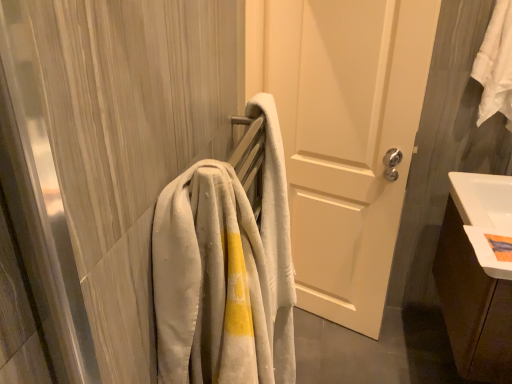
The image size is (512, 384). What do you see at coordinates (343, 136) in the screenshot?
I see `white matte door at center` at bounding box center [343, 136].

What do you see at coordinates (472, 305) in the screenshot? This screenshot has width=512, height=384. I see `brown wood cabinet at lower right` at bounding box center [472, 305].

Measure the distance between brown wood cabinet at lower right and camera.

The distance of brown wood cabinet at lower right from camera is 1.10 meters.

The height and width of the screenshot is (384, 512). Describe the element at coordinates (217, 285) in the screenshot. I see `light gray plush towel at left` at that location.

Where is `white cotton towel at upper right`? The height and width of the screenshot is (384, 512). white cotton towel at upper right is located at coordinates (496, 65).

Identify the location of white matte door at center. This screenshot has width=512, height=384. (343, 136).

From the image's perspective, which is below, white glossy sink at lower right or light gray plush towel at left?

light gray plush towel at left is shown below in the image.

Who is more distant, white glossy sink at lower right or light gray plush towel at left?

white glossy sink at lower right.

From a real-world perspective, which object rests below the other?

white glossy sink at lower right.

How many degrees apart are the facing directions of white glossy sink at lower right and light gray plush towel at left?

176 degrees separate the facing orientations of white glossy sink at lower right and light gray plush towel at left.

From the picture: Could you tell me if light gray plush towel at left is turned towards white glossy sink at lower right?

No, light gray plush towel at left does not turn towards white glossy sink at lower right.

Considering the relative positions of light gray plush towel at left and white glossy sink at lower right in the image provided, is light gray plush towel at left to the right of white glossy sink at lower right from the viewer's perspective?

No, light gray plush towel at left is not to the right of white glossy sink at lower right.

Does light gray plush towel at left have a lesser width compared to white glossy sink at lower right?

Yes.

I want to click on door located on the left of white glossy sink at lower right, so click(x=343, y=136).

Who is smaller, white glossy sink at lower right or white matte door at center?

With smaller size is white glossy sink at lower right.

Considering the points (487, 215) and (322, 35), which point is behind, point (487, 215) or point (322, 35)?

The point (322, 35) is farther from the camera.

What's the angular difference between white glossy sink at lower right and white matte door at center's facing directions?

There is a 80.3-degree angle between the facing directions of white glossy sink at lower right and white matte door at center.

Based on the photo, from the image's perspective, is brown wood cabinet at lower right located beneath white cotton towel at upper right?

Correct, brown wood cabinet at lower right appears lower than white cotton towel at upper right in the image.

Is brown wood cabinet at lower right shorter than white cotton towel at upper right?

Indeed, brown wood cabinet at lower right has a lesser height compared to white cotton towel at upper right.

Could you tell me if brown wood cabinet at lower right is turned towards white cotton towel at upper right?

No, brown wood cabinet at lower right is not turned towards white cotton towel at upper right.

In the scene shown: Is brown wood cabinet at lower right not within white cotton towel at upper right?

Indeed, brown wood cabinet at lower right is completely outside white cotton towel at upper right.

Could you tell me if brown wood cabinet at lower right is turned towards light gray plush towel at left?

No, brown wood cabinet at lower right is not oriented towards light gray plush towel at left.

Between brown wood cabinet at lower right and light gray plush towel at left, which one has more height?

light gray plush towel at left is taller.

Considering the relative sizes of brown wood cabinet at lower right and light gray plush towel at left in the image provided, is brown wood cabinet at lower right bigger than light gray plush towel at left?

Indeed, brown wood cabinet at lower right has a larger size compared to light gray plush towel at left.

Does brown wood cabinet at lower right have a lesser width compared to light gray plush towel at left?

Incorrect, the width of brown wood cabinet at lower right is not less than that of light gray plush towel at left.

Is brown wood cabinet at lower right to the left of white glossy sink at lower right from the viewer's perspective?

In fact, brown wood cabinet at lower right is to the right of white glossy sink at lower right.

From a real-world perspective, is brown wood cabinet at lower right positioned over white glossy sink at lower right based on gravity?

Incorrect, from a real-world perspective, brown wood cabinet at lower right is lower than white glossy sink at lower right.

How distant is brown wood cabinet at lower right from white glossy sink at lower right?

They are 6.75 inches apart.

Is brown wood cabinet at lower right a part of white glossy sink at lower right?

No, brown wood cabinet at lower right is not surrounded by white glossy sink at lower right.

Does white glossy sink at lower right touch brown wood cabinet at lower right?

No, white glossy sink at lower right is not with brown wood cabinet at lower right.

Based on the photo, is white glossy sink at lower right taller or shorter than brown wood cabinet at lower right?

Clearly, white glossy sink at lower right is shorter compared to brown wood cabinet at lower right.

Where is `sink located behind the light gray plush towel at left`? sink located behind the light gray plush towel at left is located at coordinates (484, 215).

Locate an element on the screen. This screenshot has height=384, width=512. sink below the light gray plush towel at left (from a real-world perspective) is located at coordinates (484, 215).

Based on their spatial positions, is brown wood cabinet at lower right or white matte door at center closer to white glossy sink at lower right?

brown wood cabinet at lower right is closer to white glossy sink at lower right.

Which object lies further to the anchor point white cotton towel at upper right, white glossy sink at lower right or brown wood cabinet at lower right?

brown wood cabinet at lower right.

Which object lies further to the anchor point white matte door at center, white cotton towel at upper right or light gray plush towel at left?

light gray plush towel at left lies further to white matte door at center than the other object.

Estimate the real-world distances between objects in this image. Which object is closer to light gray plush towel at left, white matte door at center or white glossy sink at lower right?

The object closer to light gray plush towel at left is white glossy sink at lower right.

Considering their positions, is white cotton towel at upper right positioned closer to white glossy sink at lower right than light gray plush towel at left?

white cotton towel at upper right lies closer to white glossy sink at lower right than the other object.

Which object lies further to the anchor point white cotton towel at upper right, brown wood cabinet at lower right or light gray plush towel at left?

The object further to white cotton towel at upper right is light gray plush towel at left.

Considering their positions, is white matte door at center positioned closer to light gray plush towel at left than brown wood cabinet at lower right?

brown wood cabinet at lower right lies closer to light gray plush towel at left than the other object.

Which object lies nearer to the anchor point white cotton towel at upper right, white glossy sink at lower right or white matte door at center?

white glossy sink at lower right is closer to white cotton towel at upper right.

Where is `sink located between white matte door at center and white cotton towel at upper right in the left-right direction`? sink located between white matte door at center and white cotton towel at upper right in the left-right direction is located at coordinates (484, 215).

Find the location of a particular element. The image size is (512, 384). sink between light gray plush towel at left and white cotton towel at upper right in the horizontal direction is located at coordinates (484, 215).

This screenshot has height=384, width=512. What are the coordinates of `door between light gray plush towel at left and brown wood cabinet at lower right in the horizontal direction` in the screenshot? It's located at (343, 136).

This screenshot has width=512, height=384. I want to click on sink situated between light gray plush towel at left and brown wood cabinet at lower right from left to right, so click(484, 215).